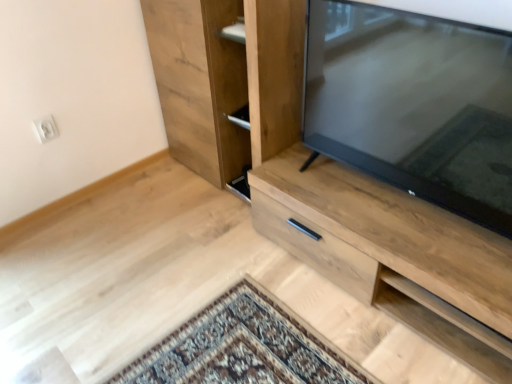
What do you see at coordinates (225, 80) in the screenshot? Image resolution: width=512 pixels, height=384 pixels. I see `natural wood cupboard at center` at bounding box center [225, 80].

Where is `light wood cabinet at center`? The height and width of the screenshot is (384, 512). light wood cabinet at center is located at coordinates (393, 254).

In the scene shown: Measure the distance between point [434,249] and camera.

They are 4.37 feet apart.

What is the approximate width of matte black tv at right?

matte black tv at right is 6.51 inches wide.

Identify the location of natural wood cupboard at center. The height and width of the screenshot is (384, 512). (225, 80).

Is natural wood cupboard at center not within light wood cabinet at center?

Yes, natural wood cupboard at center is not within light wood cabinet at center.

Is natural wood cupboard at center at the left side of light wood cabinet at center?

Yes.

How many degrees apart are the facing directions of natural wood cupboard at center and light wood cabinet at center?

The angular difference between natural wood cupboard at center and light wood cabinet at center is 0.000232 degrees.

From a real-world perspective, is natural wood cupboard at center below light wood cabinet at center?

No, from a real-world perspective, natural wood cupboard at center is not below light wood cabinet at center.

Which is in front, matte black tv at right or natural wood cupboard at center?

matte black tv at right is closer to the camera.

Is natural wood cupboard at center surrounded by matte black tv at right?

Actually, natural wood cupboard at center is outside matte black tv at right.

Who is taller, matte black tv at right or natural wood cupboard at center?

natural wood cupboard at center.

Does matte black tv at right appear on the right side of natural wood cupboard at center?

Yes, matte black tv at right is to the right of natural wood cupboard at center.

Between light wood cabinet at center and matte black tv at right, which one has larger size?

Bigger between the two is light wood cabinet at center.

Considering their positions, is light wood cabinet at center located in front of or behind matte black tv at right?

light wood cabinet at center is behind matte black tv at right.

Can you confirm if light wood cabinet at center is wider than matte black tv at right?

Yes, light wood cabinet at center is wider than matte black tv at right.

From a real-world perspective, is light wood cabinet at center physically located above or below matte black tv at right?

In terms of real-world spatial position, light wood cabinet at center is below matte black tv at right.

Does point (259, 187) appear closer or farther from the camera than point (247, 145)?

Point (259, 187) is positioned closer to the camera compared to point (247, 145).

Is light wood cabinet at center turned away from natural wood cupboard at center?

That's not correct — light wood cabinet at center is not looking away from natural wood cupboard at center.

Can you tell me how much light wood cabinet at center and natural wood cupboard at center differ in facing direction?

They differ by 0.000232 degrees in their facing directions.

From the image's perspective, is light wood cabinet at center under natural wood cupboard at center?

Correct, light wood cabinet at center appears lower than natural wood cupboard at center in the image.

Between matte black tv at right and light wood cabinet at center, which one has more height?

With more height is matte black tv at right.

I want to click on cabinetry on the right side of matte black tv at right, so click(x=393, y=254).

Considering the sizes of objects matte black tv at right and light wood cabinet at center in the image provided, who is wider, matte black tv at right or light wood cabinet at center?

light wood cabinet at center is wider.

Is matte black tv at right in front of or behind light wood cabinet at center in the image?

matte black tv at right is positioned closer to the viewer than light wood cabinet at center.

Where is `cupboard on the left of matte black tv at right`? cupboard on the left of matte black tv at right is located at coordinates (225, 80).

Is natural wood cupboard at center wider or thinner than matte black tv at right?

natural wood cupboard at center is wider than matte black tv at right.

Considering the positions of objects natural wood cupboard at center and matte black tv at right in the image provided, who is behind, natural wood cupboard at center or matte black tv at right?

natural wood cupboard at center is more distant.

Where is `cabinetry in front of the natural wood cupboard at center`? cabinetry in front of the natural wood cupboard at center is located at coordinates (393, 254).

The image size is (512, 384). What are the coordinates of `cupboard to the left of matte black tv at right` in the screenshot? It's located at (225, 80).

In the scene shown: Which object lies nearer to the anchor point natural wood cupboard at center, matte black tv at right or light wood cabinet at center?

light wood cabinet at center.

Which object lies nearer to the anchor point natural wood cupboard at center, light wood cabinet at center or matte black tv at right?

light wood cabinet at center lies closer to natural wood cupboard at center than the other object.

Looking at this image, considering their positions, is matte black tv at right positioned further to light wood cabinet at center than natural wood cupboard at center?

natural wood cupboard at center lies further to light wood cabinet at center than the other object.

Based on their spatial positions, is natural wood cupboard at center or matte black tv at right further from light wood cabinet at center?

natural wood cupboard at center is further to light wood cabinet at center.

Based on their spatial positions, is natural wood cupboard at center or light wood cabinet at center further from matte black tv at right?

Among the two, natural wood cupboard at center is located further to matte black tv at right.

Looking at the image, which one is located closer to matte black tv at right, light wood cabinet at center or natural wood cupboard at center?

light wood cabinet at center is positioned closer to the anchor matte black tv at right.

Identify the location of television situated between natural wood cupboard at center and light wood cabinet at center from left to right. (414, 104).